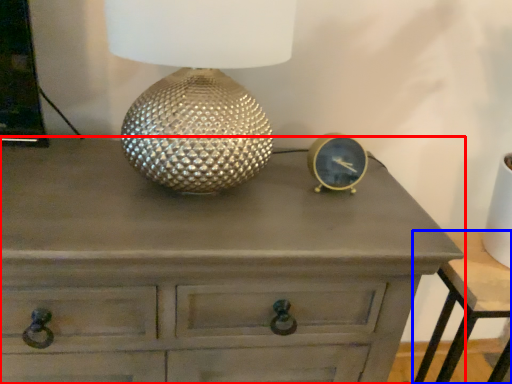
Question: Which object is further to the camera taking this photo, chest of drawers (highlighted by a red box) or nightstand (highlighted by a blue box)?

Choices:
 (A) chest of drawers
 (B) nightstand

Answer: (B)